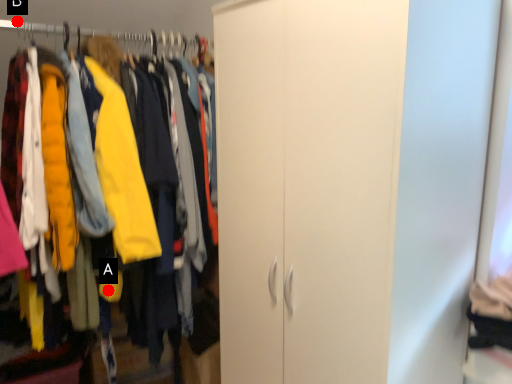
Question: Two points are circled on the image, labeled by A and B beside each circle. Which point is closer to the camera?

Choices:
 (A) A is closer
 (B) B is closer

Answer: (A)